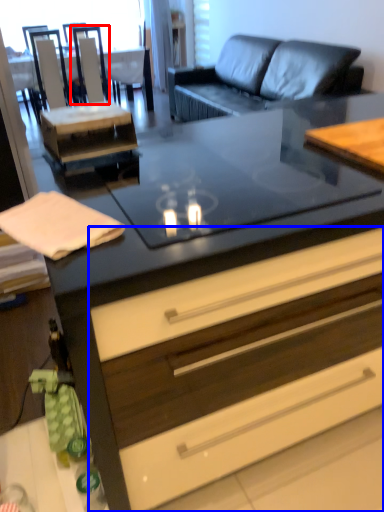
Question: Among these objects, which one is farthest to the camera, armchair (highlighted by a red box) or drawer (highlighted by a blue box)?

Choices:
 (A) armchair
 (B) drawer

Answer: (A)